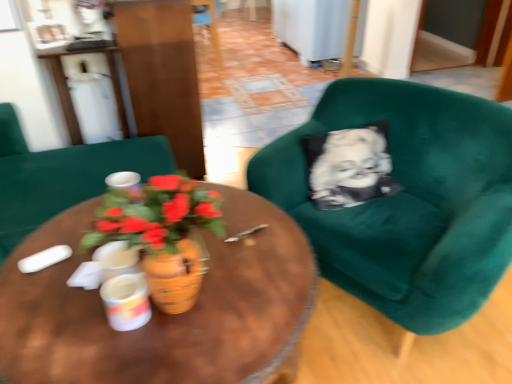
What are the coordinates of `vacant area that lies to the right of white glossy coffee cup at center, which appears as the second coffee cup when viewed from the left` in the screenshot? It's located at (205, 321).